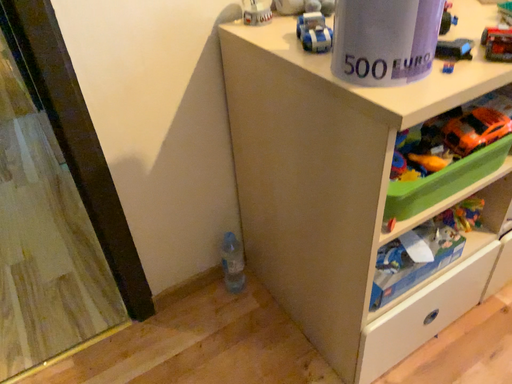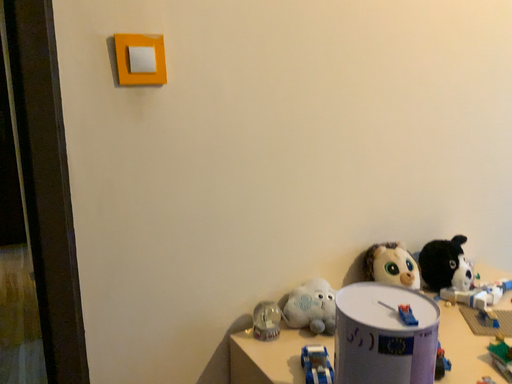
Question: How did the camera likely rotate when shooting the video?

Choices:
 (A) rotated downward
 (B) rotated upward

Answer: (B)